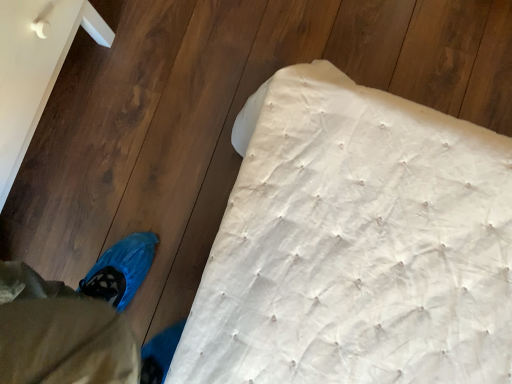
The width and height of the screenshot is (512, 384). Find the location of `white quilted mattress at lower right`. white quilted mattress at lower right is located at coordinates (356, 244).

The image size is (512, 384). Describe the element at coordinates (356, 244) in the screenshot. I see `white quilted mattress at lower right` at that location.

I want to click on blue fabric bag at lower left, so click(x=35, y=68).

The width and height of the screenshot is (512, 384). What do you see at coordinates (35, 68) in the screenshot? I see `blue fabric bag at lower left` at bounding box center [35, 68].

Image resolution: width=512 pixels, height=384 pixels. What are the coordinates of `white quilted mattress at lower right` in the screenshot? It's located at (356, 244).

Is white quilted mattress at lower right to the right of blue fabric bag at lower left from the viewer's perspective?

Yes.

Considering the positions of objects white quilted mattress at lower right and blue fabric bag at lower left in the image provided, who is in front, white quilted mattress at lower right or blue fabric bag at lower left?

blue fabric bag at lower left is closer to the camera.

Which is less distant, (375, 378) or (33, 76)?

The point (375, 378) is closer.

From the image's perspective, is white quilted mattress at lower right located above blue fabric bag at lower left?

No.

From a real-world perspective, which is physically below, white quilted mattress at lower right or blue fabric bag at lower left?

white quilted mattress at lower right.

Between white quilted mattress at lower right and blue fabric bag at lower left, which one has larger width?

Wider between the two is white quilted mattress at lower right.

Considering the sizes of objects white quilted mattress at lower right and blue fabric bag at lower left in the image provided, who is taller, white quilted mattress at lower right or blue fabric bag at lower left?

With more height is blue fabric bag at lower left.

Looking at the image, does white quilted mattress at lower right seem bigger or smaller compared to blue fabric bag at lower left?

Considering their sizes, white quilted mattress at lower right takes up more space than blue fabric bag at lower left.

Is white quilted mattress at lower right outside of blue fabric bag at lower left?

white quilted mattress at lower right lies outside blue fabric bag at lower left's area.

Is white quilted mattress at lower right beside blue fabric bag at lower left?

white quilted mattress at lower right and blue fabric bag at lower left are not in contact.

Looking at this image, is white quilted mattress at lower right oriented away from blue fabric bag at lower left?

No, blue fabric bag at lower left is not at the back of white quilted mattress at lower right.

How many degrees apart are the facing directions of white quilted mattress at lower right and blue fabric bag at lower left?

The angle between the facing direction of white quilted mattress at lower right and the facing direction of blue fabric bag at lower left is 89.9 degrees.

Locate an element on the screen. The image size is (512, 384). mattress lying behind the blue fabric bag at lower left is located at coordinates (356, 244).

Does blue fabric bag at lower left appear on the right side of white quilted mattress at lower right?

Incorrect, blue fabric bag at lower left is not on the right side of white quilted mattress at lower right.

Relative to white quilted mattress at lower right, is blue fabric bag at lower left in front or behind?

blue fabric bag at lower left is positioned closer to the viewer than white quilted mattress at lower right.

Between point (2, 71) and point (225, 241), which one is positioned in front?

The point (225, 241) is in front.

From the image's perspective, does blue fabric bag at lower left appear lower than white quilted mattress at lower right?

No, from the image's perspective, blue fabric bag at lower left is not beneath white quilted mattress at lower right.

Looking at this image, from a real-world perspective, who is located higher, blue fabric bag at lower left or white quilted mattress at lower right?

From a 3D spatial view, blue fabric bag at lower left is above.

Looking at their sizes, would you say blue fabric bag at lower left is wider or thinner than white quilted mattress at lower right?

blue fabric bag at lower left is thinner than white quilted mattress at lower right.

Which of these two, blue fabric bag at lower left or white quilted mattress at lower right, stands taller?

Standing taller between the two is blue fabric bag at lower left.

Between blue fabric bag at lower left and white quilted mattress at lower right, which one has larger size?

Bigger between the two is white quilted mattress at lower right.

Could white quilted mattress at lower right be considered to be inside blue fabric bag at lower left?

No, blue fabric bag at lower left does not contain white quilted mattress at lower right.

Is blue fabric bag at lower left touching white quilted mattress at lower right?

No, blue fabric bag at lower left is not in contact with white quilted mattress at lower right.

Is blue fabric bag at lower left positioned with its back to white quilted mattress at lower right?

That's not correct — blue fabric bag at lower left is not looking away from white quilted mattress at lower right.

This screenshot has height=384, width=512. I want to click on furniture on the left of white quilted mattress at lower right, so click(x=35, y=68).

Find the location of a particular element. furniture in front of the white quilted mattress at lower right is located at coordinates (35, 68).

Find the location of `mattress below the blue fabric bag at lower left (from the image's perspective)`. mattress below the blue fabric bag at lower left (from the image's perspective) is located at coordinates (356, 244).